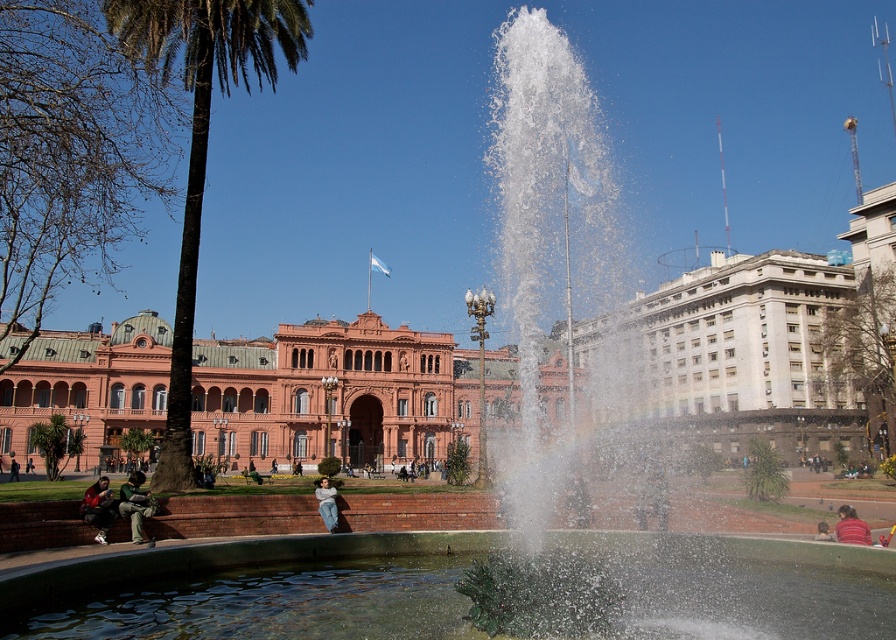
Question: Among these points, which one is nearest to the camera?

Choices:
 (A) (826, 536)
 (B) (11, 468)
 (C) (324, 477)

Answer: (A)

Question: Can you confirm if red shirt at lower right is smaller than dark brown leather jacket at lower right?

Choices:
 (A) yes
 (B) no

Answer: (B)

Question: Among these objects, which one is farthest from the camera?

Choices:
 (A) red shirt at lower right
 (B) green fabric jacket at lower left
 (C) leather jacket at lower left

Answer: (A)

Question: Among these objects, which one is farthest from the camera?

Choices:
 (A) matte pink building at center
 (B) leather jacket at lower left
 (C) red shirt at lower right
 (D) dark green fabric jacket at lower left

Answer: (D)

Question: Does leather jacket at lower left come behind red shirt at lower right?

Choices:
 (A) no
 (B) yes

Answer: (A)

Question: From the image, what is the correct spatial relationship of green fabric jacket at lower left in relation to denim jeans at lower center?

Choices:
 (A) left
 (B) right

Answer: (A)